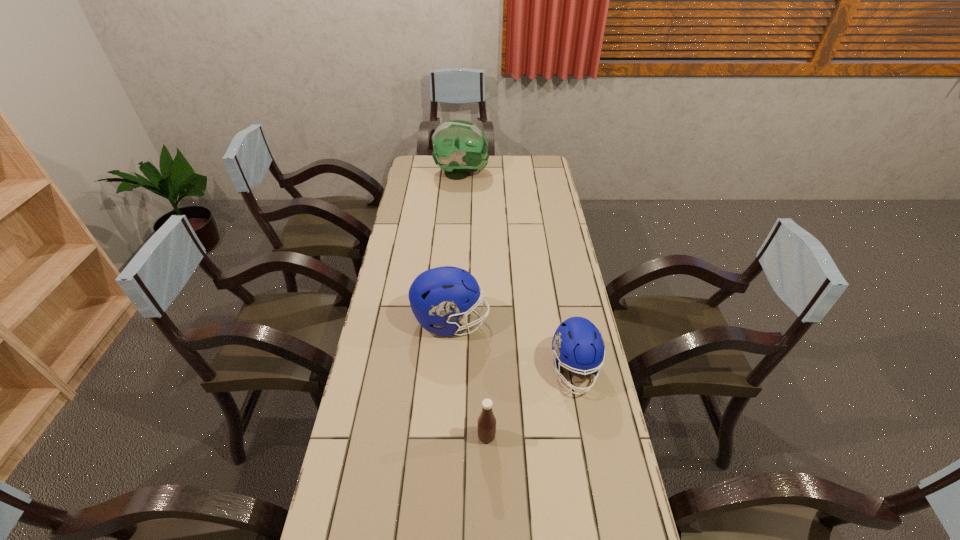
Find the location of a particular element. This screenshot has height=540, width=960. free space that satisfies the following two spatial constraints: 1. on the visor of the tallest football helmet; 2. on the back side of the nearest object is located at coordinates (445, 437).

Image resolution: width=960 pixels, height=540 pixels. Find the location of `free spot that satisfies the following two spatial constraints: 1. on the visor of the farthest football helmet; 2. on the back side of the nearest object`. free spot that satisfies the following two spatial constraints: 1. on the visor of the farthest football helmet; 2. on the back side of the nearest object is located at coordinates click(445, 437).

Image resolution: width=960 pixels, height=540 pixels. I want to click on free space that satisfies the following two spatial constraints: 1. on the visor of the farthest football helmet; 2. on the right side of the Tabasco sauce, so click(x=445, y=437).

What are the coordinates of `free spot that satisfies the following two spatial constraints: 1. on the back side of the Tabasco sauce; 2. on the visor of the tallest object` in the screenshot? It's located at (484, 174).

Find the location of a particular element. vacant space that satisfies the following two spatial constraints: 1. on the visor of the tallest football helmet; 2. on the left side of the Tabasco sauce is located at coordinates (445, 437).

Find the location of a particular element. The image size is (960, 540). free space that satisfies the following two spatial constraints: 1. on the visor of the farthest football helmet; 2. on the back side of the nearest object is located at coordinates (445, 437).